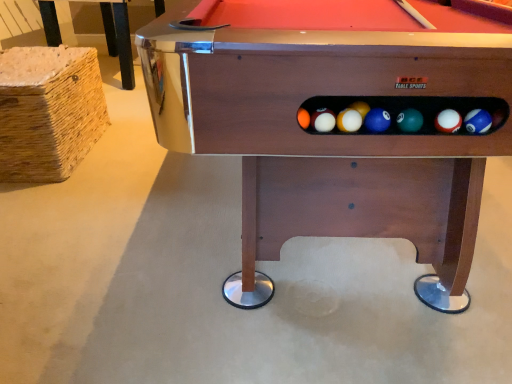
Question: From the image's perspective, is wooden billiard table at center above or below shiny metallic pool table at upper left?

Choices:
 (A) above
 (B) below

Answer: (B)

Question: In terms of height, does wooden billiard table at center look taller or shorter compared to shiny metallic pool table at upper left?

Choices:
 (A) short
 (B) tall

Answer: (B)

Question: Looking at the image, does wooden billiard table at center seem bigger or smaller compared to shiny metallic pool table at upper left?

Choices:
 (A) small
 (B) big

Answer: (B)

Question: Is shiny metallic pool table at upper left bigger or smaller than wooden billiard table at center?

Choices:
 (A) small
 (B) big

Answer: (A)

Question: From the image's perspective, is shiny metallic pool table at upper left positioned above or below wooden billiard table at center?

Choices:
 (A) below
 (B) above

Answer: (B)

Question: Does point (130, 79) appear closer or farther from the camera than point (443, 288)?

Choices:
 (A) closer
 (B) farther

Answer: (B)

Question: In the image, is shiny metallic pool table at upper left positioned in front of or behind wooden billiard table at center?

Choices:
 (A) behind
 (B) front

Answer: (A)